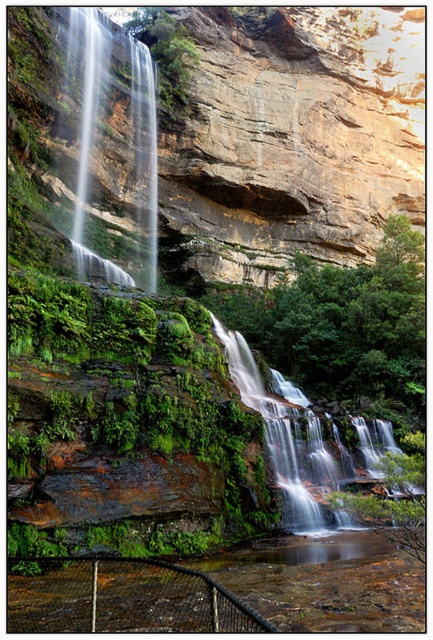
Question: In this image, where is rustic stone cliff at upper center located relative to white frothy water at center?

Choices:
 (A) right
 (B) left

Answer: (A)

Question: Does white frothy water at center have a lesser width compared to clear water at center?

Choices:
 (A) yes
 (B) no

Answer: (B)

Question: Which of the following is the farthest from the observer?

Choices:
 (A) clear water at center
 (B) rustic stone cliff at upper center
 (C) white frothy water at center

Answer: (A)

Question: Is white frothy water at center below clear water at center?

Choices:
 (A) no
 (B) yes

Answer: (B)

Question: Which of the following is the closest to the observer?

Choices:
 (A) white frothy water at center
 (B) clear water at center
 (C) rustic stone cliff at upper center

Answer: (A)

Question: Considering the real-world distances, which object is farthest from the rustic stone cliff at upper center?

Choices:
 (A) white frothy water at center
 (B) clear water at center

Answer: (A)